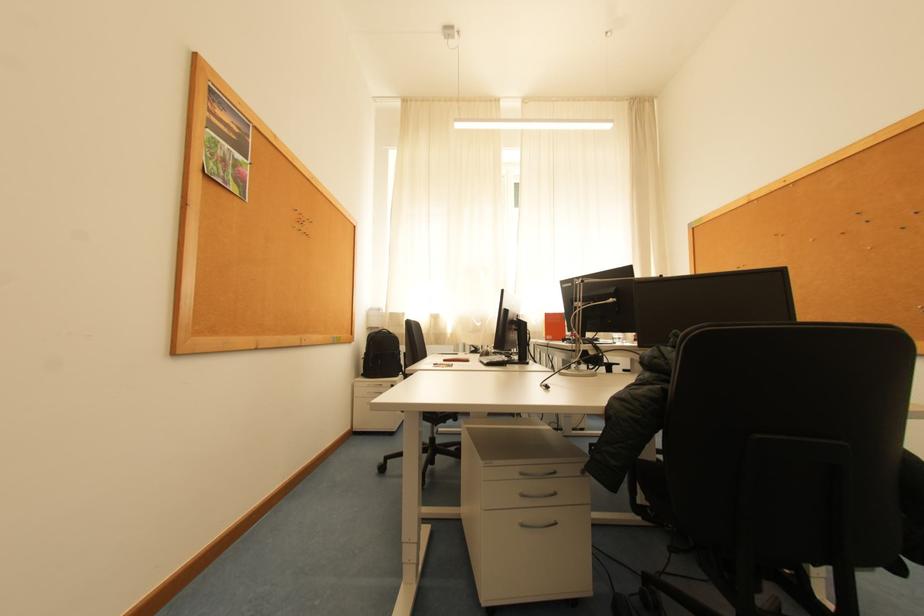
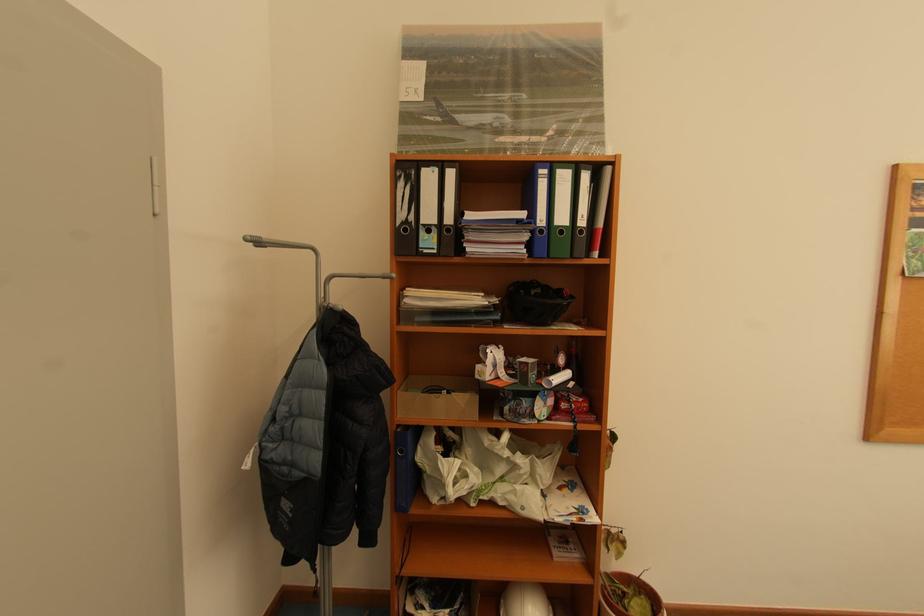
In the second image, find the point that corresponds to (203,55) in the first image.

(904, 167)